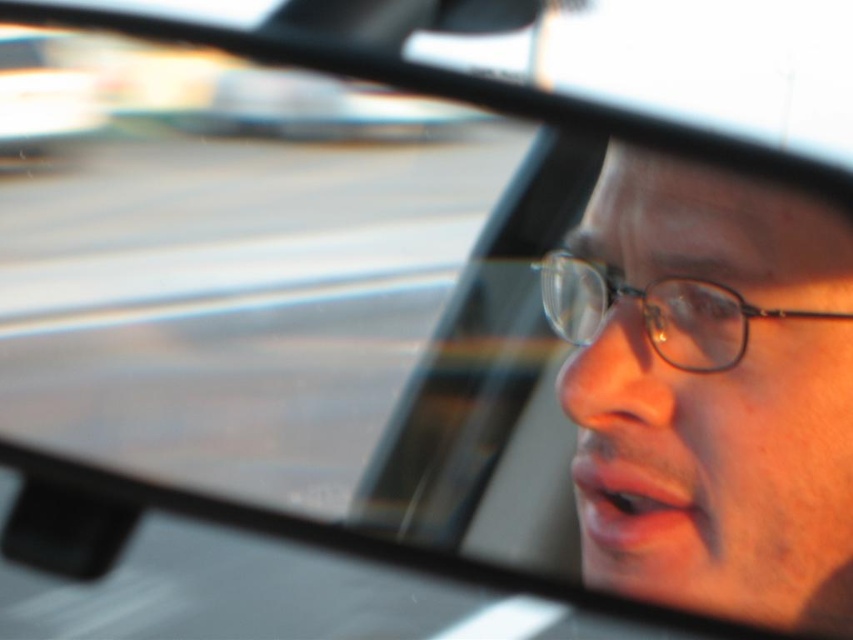
Question: Does clear plastic glasses at right appear over clear plastic glasses at center?

Choices:
 (A) no
 (B) yes

Answer: (A)

Question: Is clear plastic glasses at right wider than clear plastic glasses at center?

Choices:
 (A) yes
 (B) no

Answer: (A)

Question: Can you confirm if clear plastic glasses at right is positioned to the right of clear plastic glasses at center?

Choices:
 (A) no
 (B) yes

Answer: (B)